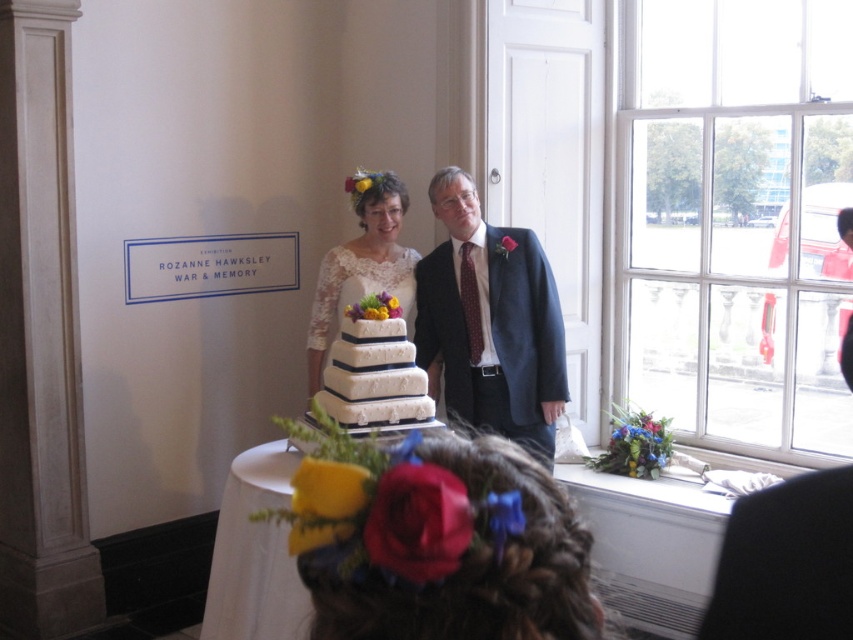
Between white textured cake at center and white lace dress at center, which one has more height?

With more height is white lace dress at center.

Who is more forward, (x=384, y=307) or (x=310, y=344)?

Positioned in front is point (x=384, y=307).

Who is more distant from viewer, [375,352] or [308,349]?

The point [308,349] is behind.

What are the coordinates of `white textured cake at center` in the screenshot? It's located at point(374,369).

Who is positioned more to the left, white textured cake at center or lace/embroidered wedding dress at center?

lace/embroidered wedding dress at center is more to the left.

Is white textured cake at center thinner than lace/embroidered wedding dress at center?

Yes, white textured cake at center is thinner than lace/embroidered wedding dress at center.

Describe the element at coordinates (374, 369) in the screenshot. I see `white textured cake at center` at that location.

You are a GUI agent. You are given a task and a screenshot of the screen. Output one action in this format:
    pyautogui.click(x=<x>, y=<y>)
    Task: Click on the white textured cake at center
    The width and height of the screenshot is (853, 640).
    Given the screenshot: What is the action you would take?
    pyautogui.click(x=374, y=369)

Consider the image. Which is more to the left, dark blue suit at center or lace/embroidered wedding dress at center?

lace/embroidered wedding dress at center is more to the left.

Who is more forward, (515, 440) or (316, 292)?

Positioned in front is point (515, 440).

The width and height of the screenshot is (853, 640). What do you see at coordinates (490, 321) in the screenshot? I see `dark blue suit at center` at bounding box center [490, 321].

Locate an element on the screen. dark blue suit at center is located at coordinates (490, 321).